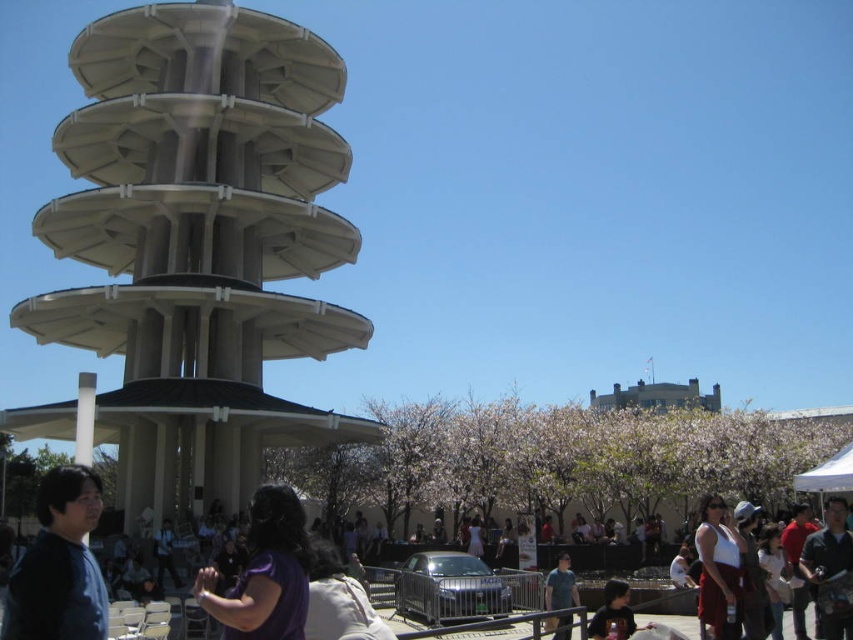
Between dark blue shirt at center and white fabric canopy at lower right, which one appears on the right side from the viewer's perspective?

From the viewer's perspective, white fabric canopy at lower right appears more on the right side.

Which is below, dark blue shirt at center or white fabric canopy at lower right?

dark blue shirt at center is lower down.

Between point (842, 625) and point (817, 477), which one is positioned in front?

Point (842, 625) is more forward.

This screenshot has width=853, height=640. Find the location of `dark blue shirt at center`. dark blue shirt at center is located at coordinates (828, 570).

Is matte blue shirt at lower left shorter than dark brown shirt at lower center?

Incorrect, matte blue shirt at lower left's height does not fall short of dark brown shirt at lower center's.

Does matte blue shirt at lower left come in front of dark brown shirt at lower center?

Yes, matte blue shirt at lower left is closer to the viewer.

Between point (90, 493) and point (624, 588), which one is positioned in front?

Point (90, 493) is more forward.

What are the coordinates of `matte blue shirt at lower left` in the screenshot? It's located at (59, 564).

Does point (57, 582) come behind point (732, 634)?

No, (57, 582) is in front of (732, 634).

Which is behind, point (106, 596) or point (701, 540)?

Positioned behind is point (701, 540).

Describe the element at coordinates (59, 564) in the screenshot. I see `matte blue shirt at lower left` at that location.

Where is `matte blue shirt at lower left`? This screenshot has width=853, height=640. matte blue shirt at lower left is located at coordinates (59, 564).